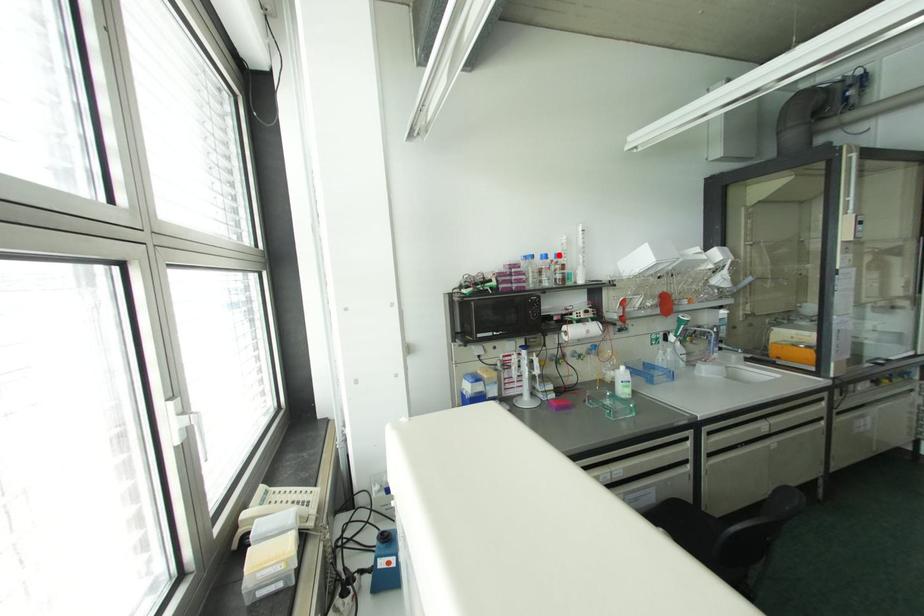
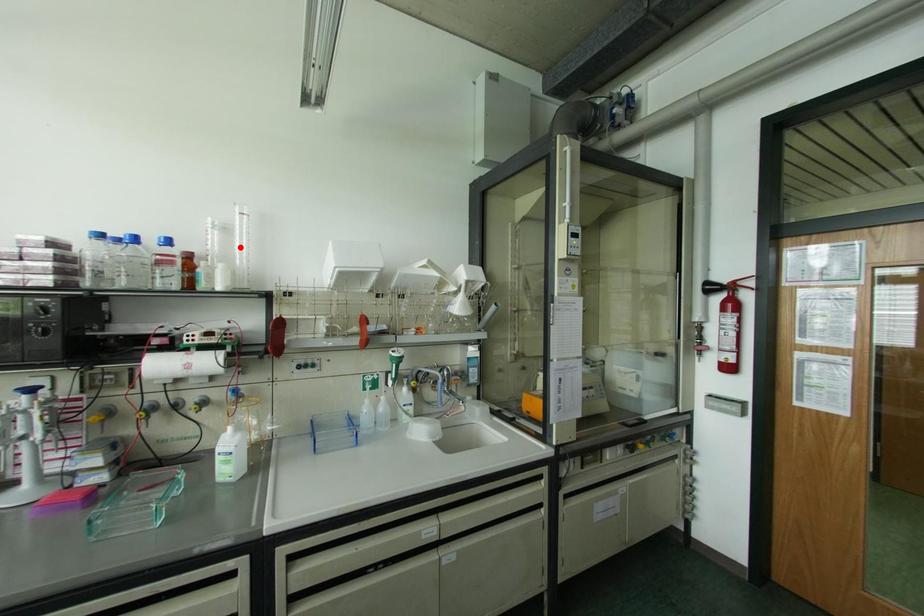
I am providing you with two images of the same scene from different viewpoints. A red point is marked on the first image and another point is marked on the second image. Do the highlighted points in image1 and image2 indicate the same real-world spot?

No